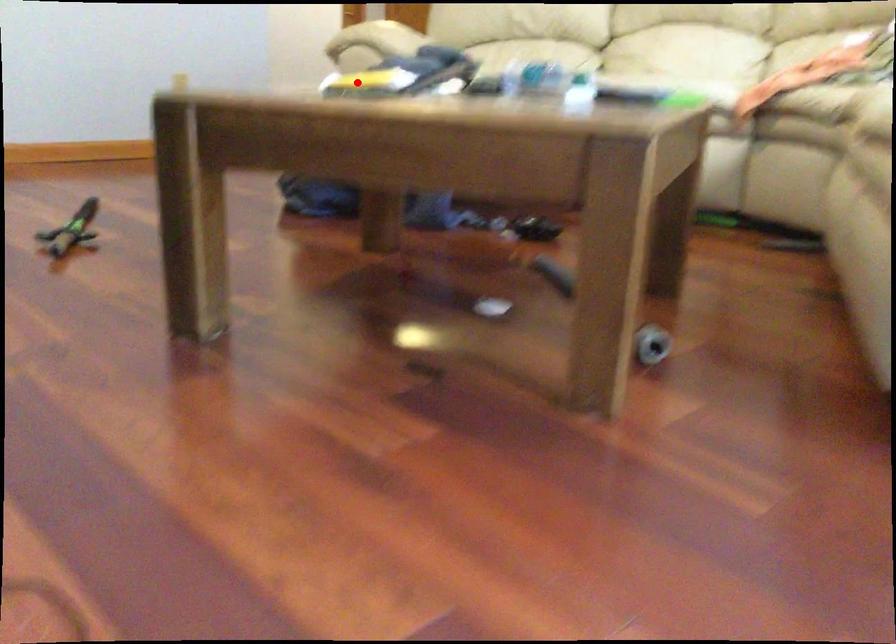
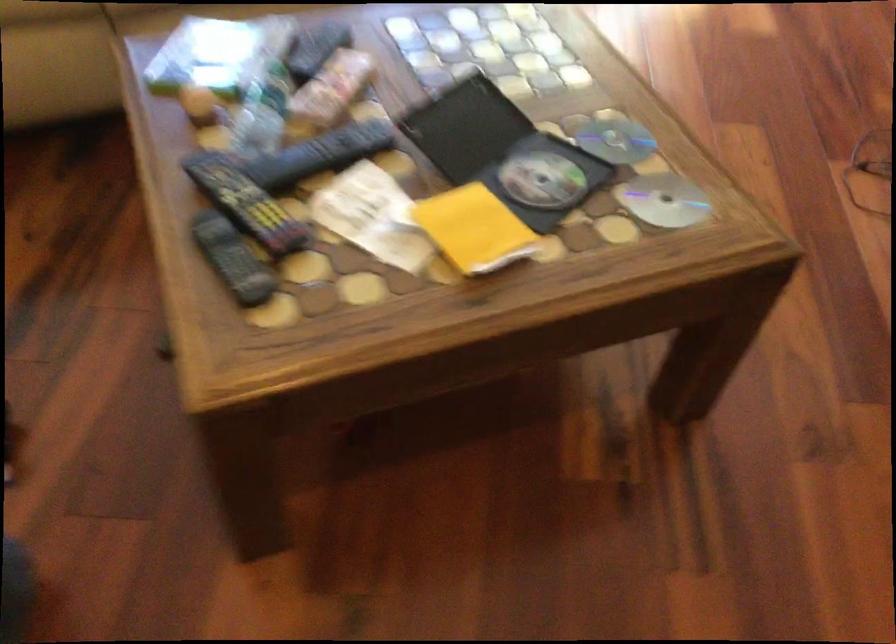
Find the pixel in the second image that matches the highlighted location in the first image.

(474, 229)